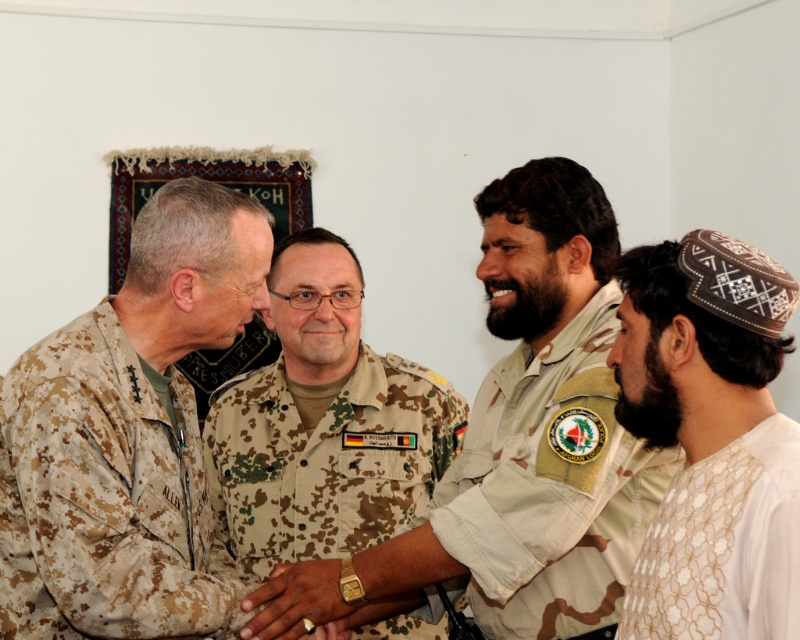
Question: Does camouflage uniform at center have a larger size compared to camouflage fabric uniform at center?

Choices:
 (A) yes
 (B) no

Answer: (A)

Question: Is camouflage uniform at center smaller than camouflage fabric uniform at center?

Choices:
 (A) no
 (B) yes

Answer: (A)

Question: Which point is farther to the camera?

Choices:
 (A) (604, 522)
 (B) (578, 339)
 (C) (200, 515)
 (D) (268, 520)

Answer: (D)

Question: Which of the following is the closest to the observer?

Choices:
 (A) (520, 273)
 (B) (492, 525)
 (C) (350, 524)

Answer: (B)

Question: Which of the following is the farthest from the observer?

Choices:
 (A) camouflage uniform at center
 (B) camouflage fabric uniform at center
 (C) white embroidered shirt at lower right

Answer: (A)

Question: Can you confirm if camouflage fabric uniform at left is thinner than white embroidered shirt at lower right?

Choices:
 (A) yes
 (B) no

Answer: (B)